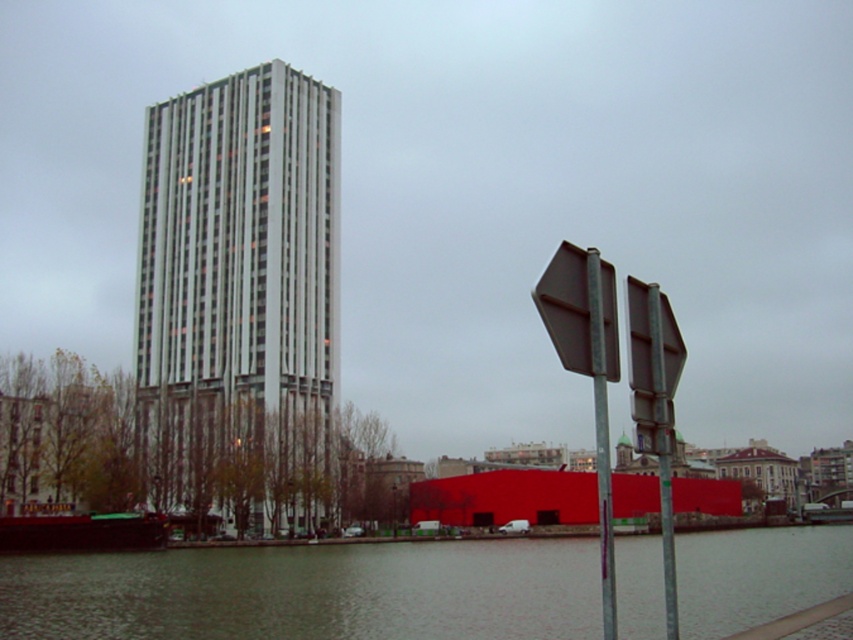
You are standing at the entrance of the red rectangular building in the foreground. You want to walk to the metallic gray hexagonal sign at right. Which direction should you turn to first see the smooth concrete river at lower center and then proceed towards the sign?

First, turn to your left to face the smooth concrete river at lower center. Then, continue walking towards the metallic gray hexagonal sign at right, which is positioned to the right of the river.